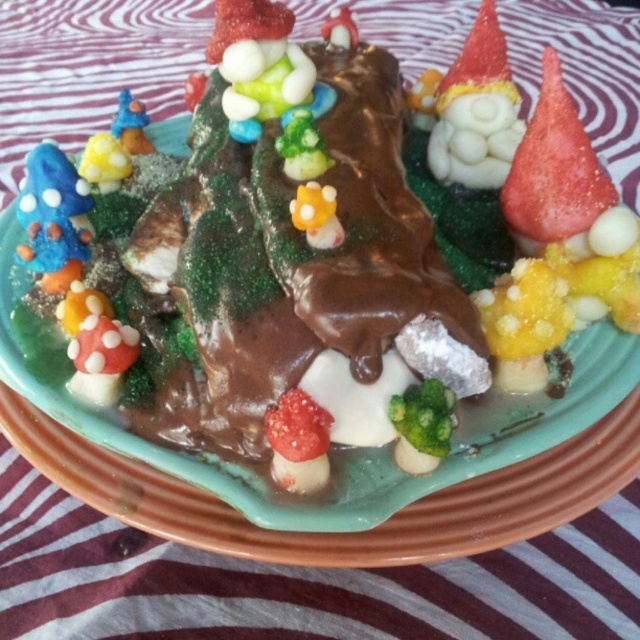
Can you confirm if strawberry at center is wider than red matte strawberry at center?

Yes, strawberry at center is wider than red matte strawberry at center.

Locate an element on the screen. strawberry at center is located at coordinates (554, 170).